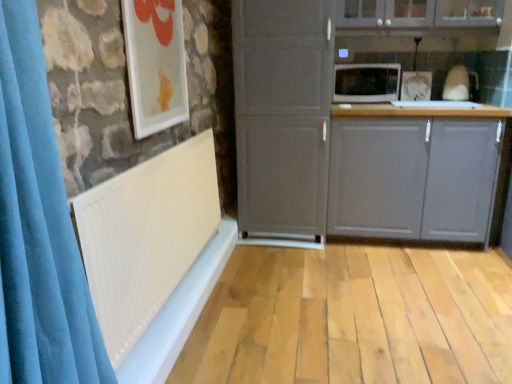
Question: Can you confirm if matte gray cupboard at center is positioned to the left of matte gray cabinet at center, which is the second cabinetry from top to bottom?

Choices:
 (A) no
 (B) yes

Answer: (B)

Question: Is matte gray cupboard at center behind matte gray cabinet at center, positioned as the 1th cabinetry in bottom-to-top order?

Choices:
 (A) yes
 (B) no

Answer: (B)

Question: Is matte gray cupboard at center taller than matte gray cabinet at center, positioned as the 1th cabinetry in bottom-to-top order?

Choices:
 (A) yes
 (B) no

Answer: (A)

Question: Is matte gray cupboard at center at the right side of matte gray cabinet at center, which is the second cabinetry from top to bottom?

Choices:
 (A) yes
 (B) no

Answer: (B)

Question: Is matte gray cupboard at center facing away from matte gray cabinet at center, positioned as the 1th cabinetry in bottom-to-top order?

Choices:
 (A) yes
 (B) no

Answer: (B)

Question: Is matte gray cupboard at center oriented towards matte gray cabinet at center, which is the second cabinetry from top to bottom?

Choices:
 (A) no
 (B) yes

Answer: (A)

Question: Can you confirm if matte gray cabinet at upper center, placed as the first cabinetry when sorted from top to bottom, is wider than white glossy picture frame at upper left?

Choices:
 (A) yes
 (B) no

Answer: (A)

Question: Does matte gray cabinet at upper center, placed as the first cabinetry when sorted from top to bottom, have a larger size compared to white glossy picture frame at upper left?

Choices:
 (A) yes
 (B) no

Answer: (A)

Question: From a real-world perspective, is matte gray cabinet at upper center, placed as the first cabinetry when sorted from top to bottom, located beneath white glossy picture frame at upper left?

Choices:
 (A) yes
 (B) no

Answer: (B)

Question: Is matte gray cabinet at upper center, marked as the 2th cabinetry in a bottom-to-top arrangement, oriented towards white glossy picture frame at upper left?

Choices:
 (A) no
 (B) yes

Answer: (A)

Question: Does matte gray cabinet at upper center, marked as the 2th cabinetry in a bottom-to-top arrangement, appear on the right side of white glossy picture frame at upper left?

Choices:
 (A) yes
 (B) no

Answer: (A)

Question: Does matte gray cabinet at upper center, marked as the 2th cabinetry in a bottom-to-top arrangement, have a greater height compared to white glossy picture frame at upper left?

Choices:
 (A) no
 (B) yes

Answer: (A)

Question: Is matte gray cabinet at center, positioned as the 1th cabinetry in bottom-to-top order, not within white glossy picture frame at upper left?

Choices:
 (A) no
 (B) yes

Answer: (B)